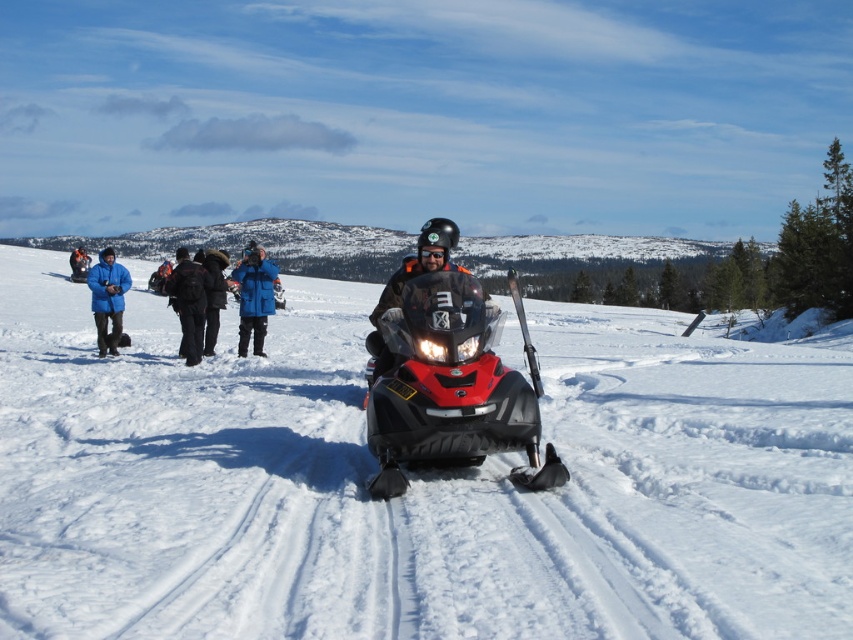
Question: Which point is closer to the camera?

Choices:
 (A) black backpack at center
 (B) blue fabric jacket at center
 (C) shiny red plastic snowmobile at center
 (D) shiny black snowmobile at center

Answer: (C)

Question: Which object is closer to the camera taking this photo?

Choices:
 (A) black matte goggles at center
 (B) shiny black snowmobile at center

Answer: (B)

Question: Does shiny black snowmobile at center come in front of dark blue jacket at center?

Choices:
 (A) no
 (B) yes

Answer: (B)

Question: Which object is closer to the camera taking this photo?

Choices:
 (A) black matte goggles at center
 (B) shiny red plastic snowmobile at center
 (C) brushed metal helmet at upper left

Answer: (B)

Question: Is black backpack at center thinner than dark blue jacket at center?

Choices:
 (A) yes
 (B) no

Answer: (B)

Question: Is dark blue jacket at center bigger than brushed metal helmet at upper left?

Choices:
 (A) yes
 (B) no

Answer: (B)